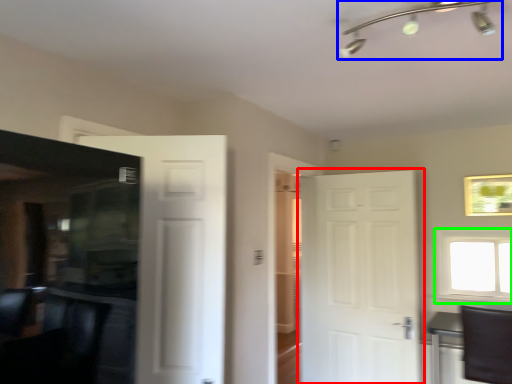
Question: Which object is the closest to the door (highlighted by a red box)? Choose among these: light fixture (highlighted by a blue box) or window (highlighted by a green box).

Choices:
 (A) light fixture
 (B) window

Answer: (B)